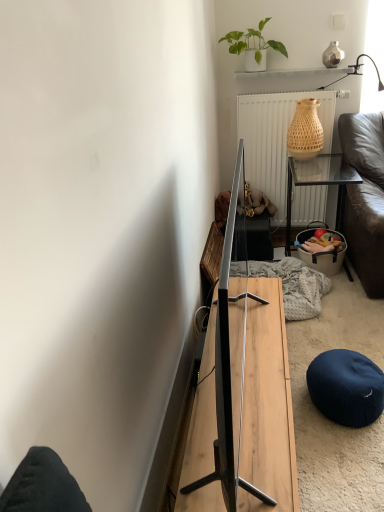
Question: Does light wood table at center, arranged as the second table when viewed from the right, have a greater width compared to dark blue fabric stool at lower right?

Choices:
 (A) no
 (B) yes

Answer: (A)

Question: Is light wood table at center, the first table viewed from the left, positioned beyond the bounds of dark blue fabric stool at lower right?

Choices:
 (A) no
 (B) yes

Answer: (B)

Question: Would you consider light wood table at center, arranged as the second table when viewed from the right, to be distant from dark blue fabric stool at lower right?

Choices:
 (A) no
 (B) yes

Answer: (A)

Question: From the image's perspective, does light wood table at center, arranged as the second table when viewed from the top, appear lower than dark blue fabric stool at lower right?

Choices:
 (A) no
 (B) yes

Answer: (A)

Question: Is light wood table at center, marked as the 1th table in a bottom-to-top arrangement, positioned with its back to dark blue fabric stool at lower right?

Choices:
 (A) no
 (B) yes

Answer: (B)

Question: Is the position of light wood table at center, arranged as the second table when viewed from the right, more distant than that of dark blue fabric stool at lower right?

Choices:
 (A) yes
 (B) no

Answer: (B)

Question: Can you confirm if wooden table at right, the second table when ordered from front to back, is taller than light wood table at center, marked as the 1th table in a bottom-to-top arrangement?

Choices:
 (A) yes
 (B) no

Answer: (A)

Question: Would you consider wooden table at right, which is counted as the 2th table, starting from the left, to be distant from light wood table at center, positioned as the 2th table in back-to-front order?

Choices:
 (A) no
 (B) yes

Answer: (B)

Question: Does wooden table at right, which is the second table in bottom-to-top order, come behind light wood table at center, the first table viewed from the left?

Choices:
 (A) no
 (B) yes

Answer: (B)

Question: From the image's perspective, does wooden table at right, the second table when ordered from front to back, appear lower than light wood table at center, positioned as the 2th table in back-to-front order?

Choices:
 (A) no
 (B) yes

Answer: (A)

Question: Is wooden table at right, arranged as the first table when viewed from the top, with light wood table at center, marked as the 1th table in a bottom-to-top arrangement?

Choices:
 (A) no
 (B) yes

Answer: (A)

Question: Would you say wooden table at right, the second table when ordered from front to back, contains light wood table at center, positioned as the 2th table in back-to-front order?

Choices:
 (A) yes
 (B) no

Answer: (B)

Question: Does white textured radiator at upper center appear on the left side of wooden table at right, the second table when ordered from front to back?

Choices:
 (A) no
 (B) yes

Answer: (B)